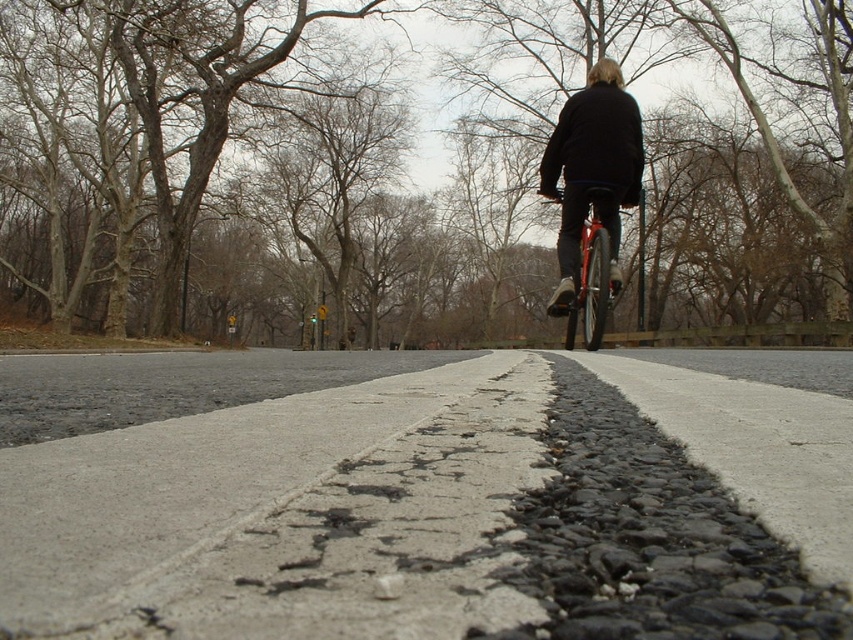
Is asphalt at center wider than shiny red bicycle at center?

Correct, the width of asphalt at center exceeds that of shiny red bicycle at center.

Is asphalt at center to the left of shiny red bicycle at center from the viewer's perspective?

Correct, you'll find asphalt at center to the left of shiny red bicycle at center.

Image resolution: width=853 pixels, height=640 pixels. Describe the element at coordinates (444, 512) in the screenshot. I see `asphalt at center` at that location.

Identify the location of asphalt at center. Image resolution: width=853 pixels, height=640 pixels. (444, 512).